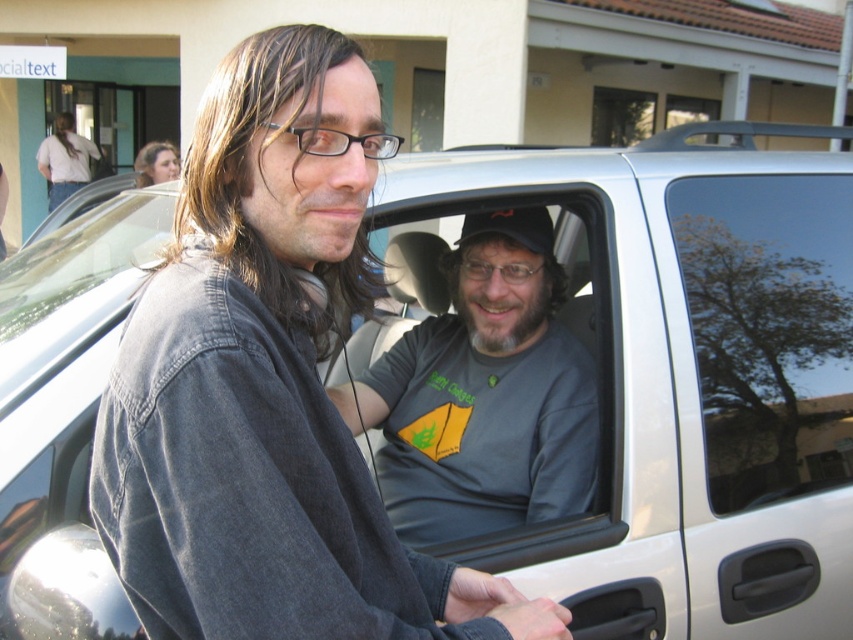
Question: Which point is closer to the camera?

Choices:
 (A) gray cotton t-shirt at center
 (B) transparent glass tree at center

Answer: (B)

Question: Can you confirm if gray cotton t-shirt at center is positioned to the right of transparent glass tree at center?

Choices:
 (A) no
 (B) yes

Answer: (A)

Question: Can you confirm if gray cotton t-shirt at center is bigger than transparent glass tree at center?

Choices:
 (A) no
 (B) yes

Answer: (B)

Question: Which of the following is the closest to the observer?

Choices:
 (A) gray cotton t-shirt at center
 (B) transparent glass tree at center

Answer: (B)

Question: Does gray cotton t-shirt at center have a lesser width compared to transparent glass tree at center?

Choices:
 (A) no
 (B) yes

Answer: (A)

Question: Which point is farther to the camera?

Choices:
 (A) transparent glass tree at center
 (B) gray cotton t-shirt at center

Answer: (B)